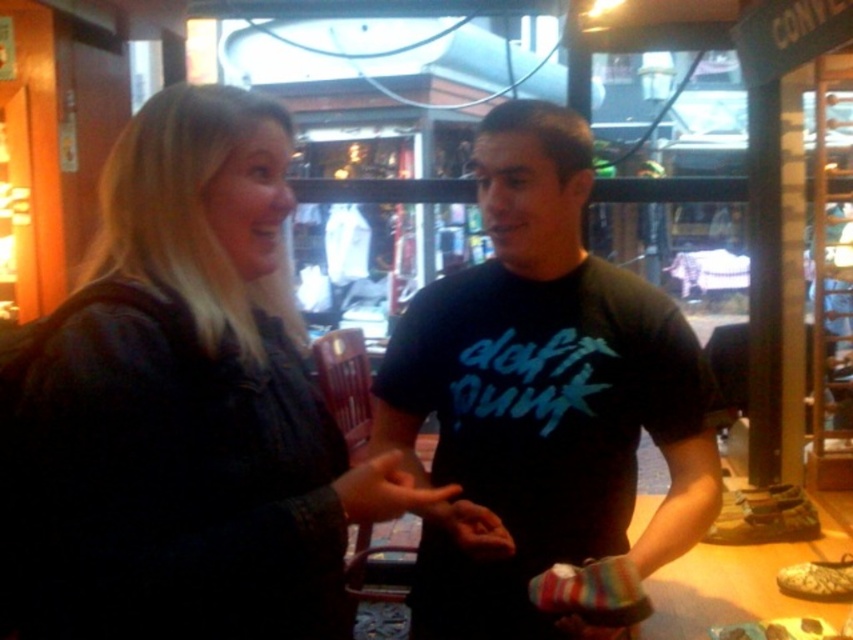
Between point (192, 465) and point (421, 488), which one is positioned in front?

Point (192, 465) is in front.

Can you confirm if leather jacket at left is taller than smooth leather hand at center?

Yes, leather jacket at left is taller than smooth leather hand at center.

This screenshot has height=640, width=853. What are the coordinates of `leather jacket at left` in the screenshot? It's located at (173, 404).

This screenshot has width=853, height=640. In order to click on leather jacket at left in this screenshot , I will do (173, 404).

Which of these two, black matte t-shirt at center or smooth leather hand at center, stands taller?

black matte t-shirt at center

Between point (469, 586) and point (354, 492), which one is positioned behind?

Point (469, 586)

Locate an element on the screen. This screenshot has width=853, height=640. black matte t-shirt at center is located at coordinates (543, 392).

Can you confirm if black matte t-shirt at center is wider than multicolored fabric glove at center?

Indeed, black matte t-shirt at center has a greater width compared to multicolored fabric glove at center.

Between point (448, 582) and point (492, 532), which one is positioned in front?

Point (492, 532) is in front.

The width and height of the screenshot is (853, 640). Identify the location of black matte t-shirt at center. 543,392.